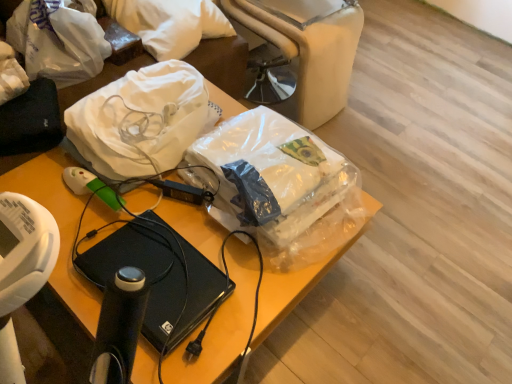
At what (x,y) coordinates should I click in order to perform the action: click on vacant area that lies to the right of black matte laptop at center. Please return your answer as a coordinate pair (x, y). Looking at the image, I should click on (241, 288).